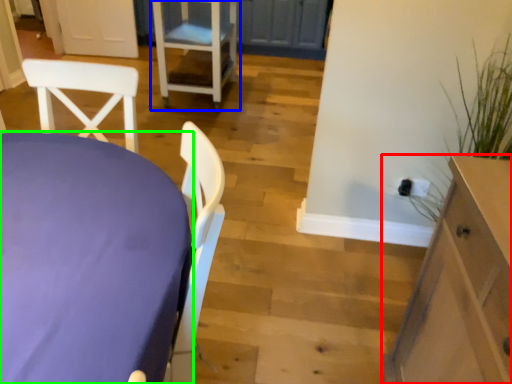
Question: Estimate the real-world distances between objects in this image. Which object is farther from cabinetry (highlighted by a red box), chair (highlighted by a blue box) or table (highlighted by a green box)?

Choices:
 (A) chair
 (B) table

Answer: (A)